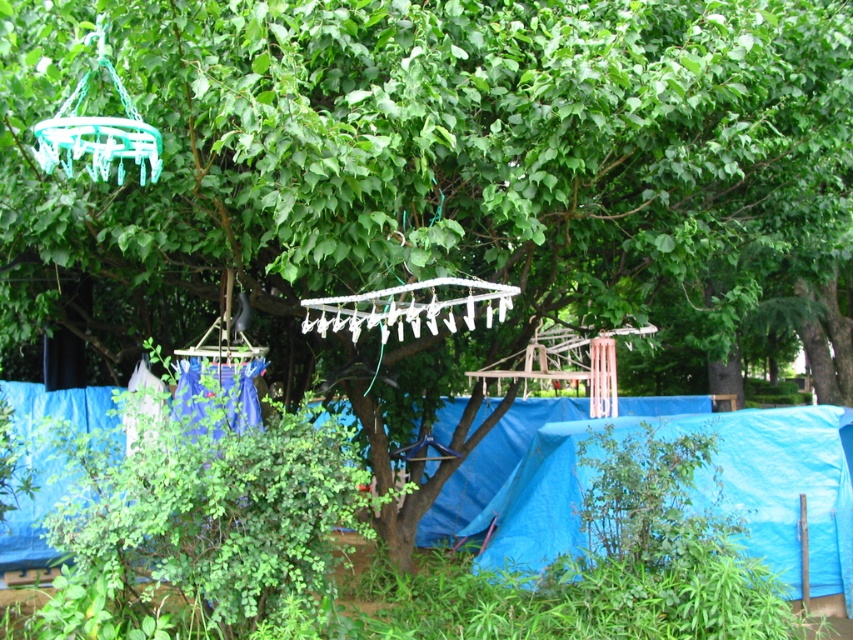
Which is above, blue tarpaulin at center or white plastic clothesline at center?

Positioned higher is white plastic clothesline at center.

Who is lower down, blue tarpaulin at center or white plastic clothesline at center?

Positioned lower is blue tarpaulin at center.

Where is `blue tarpaulin at center`? Image resolution: width=853 pixels, height=640 pixels. blue tarpaulin at center is located at coordinates (491, 465).

Which is below, blue tarpaulin at lower right or blue tarpaulin at center?

blue tarpaulin at lower right is lower down.

Consider the image. Which of these two, blue tarpaulin at lower right or blue tarpaulin at center, stands taller?

Standing taller between the two is blue tarpaulin at lower right.

Between point (665, 429) and point (488, 406), which one is positioned behind?

The point (488, 406) is more distant.

This screenshot has height=640, width=853. Identify the location of blue tarpaulin at lower right. (695, 492).

Can you confirm if blue tarpaulin at lower right is taller than white plastic clothesline at center?

Correct, blue tarpaulin at lower right is much taller as white plastic clothesline at center.

Is point (798, 433) positioned before point (421, 298)?

No, it is not.

Who is more distant from viewer, (843, 545) or (413, 312)?

Point (843, 545)

Where is `blue tarpaulin at lower right`? The height and width of the screenshot is (640, 853). blue tarpaulin at lower right is located at coordinates (695, 492).